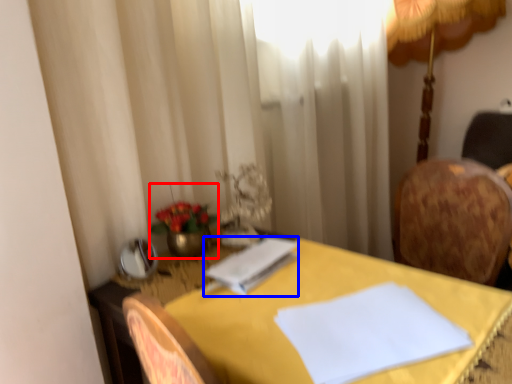
Question: Which of the following is the farthest to the observer, floral arrangement (highlighted by a red box) or notepad (highlighted by a blue box)?

Choices:
 (A) floral arrangement
 (B) notepad

Answer: (A)